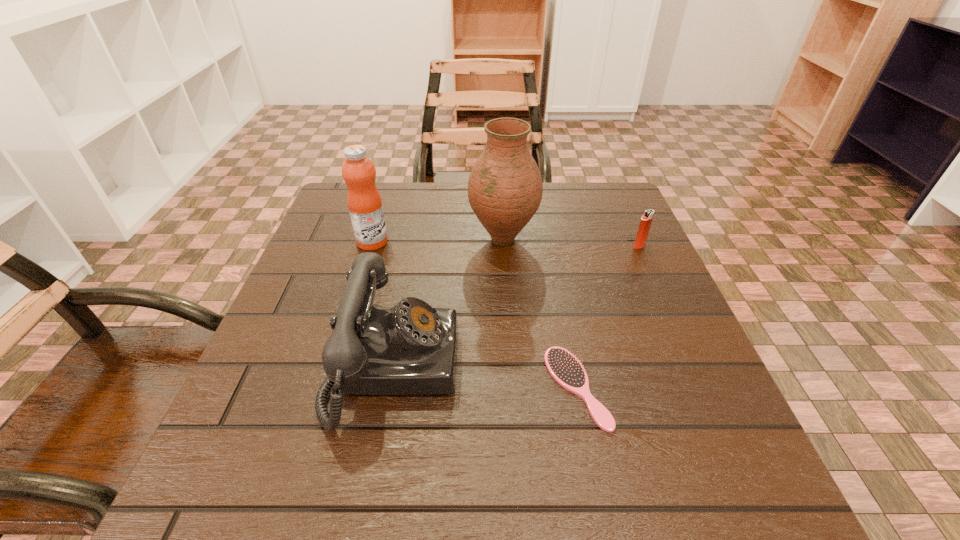
This screenshot has width=960, height=540. Identify the location of vacant space at the right edge. (636, 255).

Find the location of a particular element. vacant space at the far left corner of the desktop is located at coordinates (386, 205).

The image size is (960, 540). In the image, there is a desktop. What are the coordinates of `vacant space at the near left corner` in the screenshot? It's located at (208, 517).

I want to click on free space at the far right corner of the desktop, so click(604, 183).

Find the location of a particular element. The height and width of the screenshot is (540, 960). free space at the near right corner of the desktop is located at coordinates (756, 506).

This screenshot has width=960, height=540. In order to click on free space that is in between the shortest object and the tallest object in this screenshot , I will do `click(540, 313)`.

This screenshot has width=960, height=540. In order to click on empty space that is in between the fourth shortest object and the tallest object in this screenshot , I will do `click(438, 240)`.

Locate an element on the screen. This screenshot has height=540, width=960. vacant region between the telephone and the hairbrush is located at coordinates [485, 377].

Image resolution: width=960 pixels, height=540 pixels. I want to click on free space between the hairbrush and the tallest object, so click(x=540, y=313).

Identify the location of blank region between the vase and the rightmost object. The height and width of the screenshot is (540, 960). (571, 242).